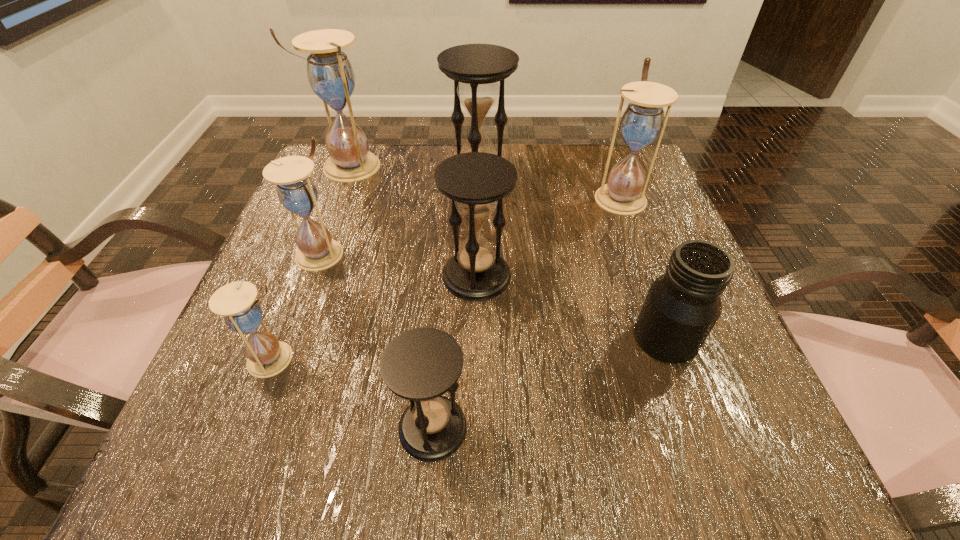
Find the location of a particular element. the second closest white hourglass to the biggest black hourglass is located at coordinates (643, 120).

Where is `the second closest black hourglass to the second biggest black hourglass`? This screenshot has width=960, height=540. the second closest black hourglass to the second biggest black hourglass is located at coordinates (421, 364).

Identify the location of the third closest black hourglass to the second biggest white hourglass. (421, 364).

Find the location of a particular element. The width and height of the screenshot is (960, 540). free space in the image that satisfies the following two spatial constraints: 1. on the front side of the biggest white hourglass; 2. on the right side of the nearest hourglass is located at coordinates (253, 428).

Where is `vacant point that satisfies the following two spatial constraints: 1. on the front side of the jar; 2. on the left side of the second biggest black hourglass`? The image size is (960, 540). vacant point that satisfies the following two spatial constraints: 1. on the front side of the jar; 2. on the left side of the second biggest black hourglass is located at coordinates (476, 338).

Find the location of a particular element. free location that satisfies the following two spatial constraints: 1. on the back side of the third farthest white hourglass; 2. on the right side of the rightmost hourglass is located at coordinates (341, 196).